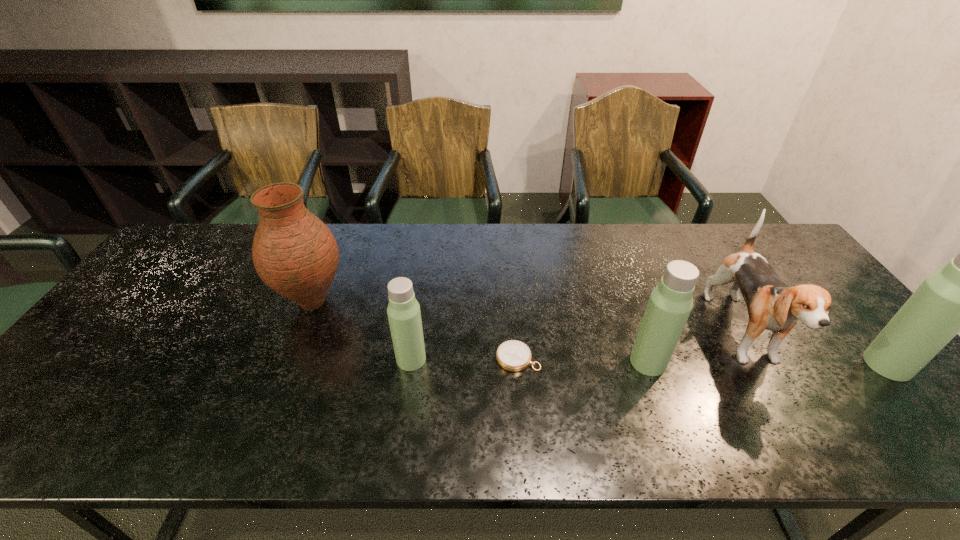
The height and width of the screenshot is (540, 960). In order to click on vacant area situated on the right of the second thermos bottle from right to left in this screenshot , I will do `click(694, 362)`.

Where is `vacant space situated 0.340m on the back of the rightmost thermos bottle`? vacant space situated 0.340m on the back of the rightmost thermos bottle is located at coordinates (801, 264).

I want to click on free point located on the left of the vase, so click(x=163, y=302).

The image size is (960, 540). Find the location of `vacant point located 0.050m at the face of the puppy`. vacant point located 0.050m at the face of the puppy is located at coordinates (789, 412).

The width and height of the screenshot is (960, 540). I want to click on vacant space located on the back of the shortest object, so click(x=511, y=264).

Identify the location of thermos bottle that is at the near edge. (959, 297).

This screenshot has height=540, width=960. Identify the location of puppy situated at the near edge. (772, 305).

I want to click on object that is at the right edge, so click(x=959, y=297).

At what (x,y) coordinates should I click in order to perform the action: click on object that is at the near right corner. Please return your answer as a coordinate pair (x, y). The width and height of the screenshot is (960, 540). Looking at the image, I should click on (959, 297).

At what (x,y) coordinates should I click in order to perform the action: click on vacant space at the far edge of the desktop. Please return your answer as a coordinate pair (x, y). The height and width of the screenshot is (540, 960). Looking at the image, I should click on (234, 247).